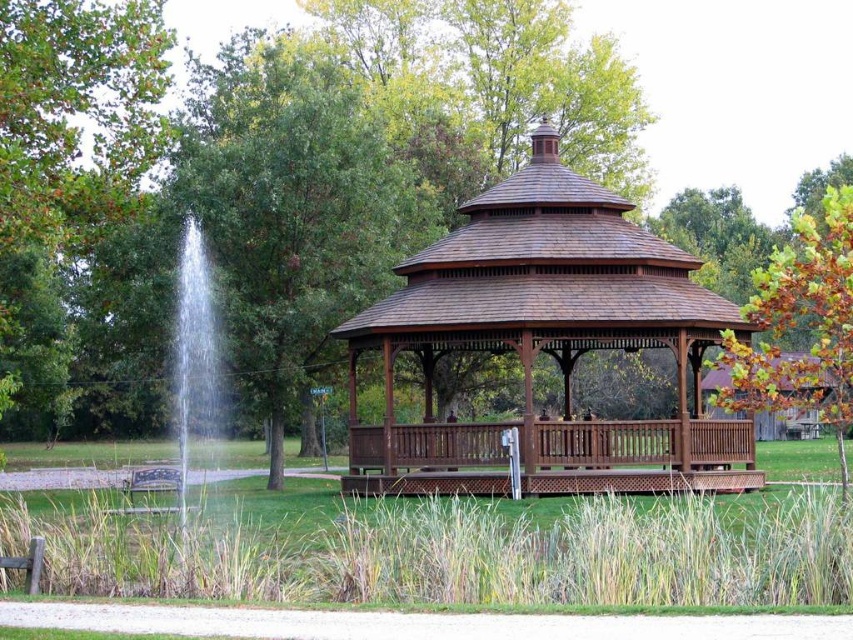
In the scene shown: Who is taller, green leafy tree at center or wooden bench at lower left?

With more height is green leafy tree at center.

Can you confirm if green leafy tree at center is thinner than wooden bench at lower left?

No, green leafy tree at center is not thinner than wooden bench at lower left.

What do you see at coordinates (735, 88) in the screenshot? I see `green leafy tree at center` at bounding box center [735, 88].

Where is `green leafy tree at center`? green leafy tree at center is located at coordinates (735, 88).

Locate an element on the screen. Image resolution: width=853 pixels, height=640 pixels. brown wooden gazebo at center is located at coordinates (546, 342).

Which of these two, brown wooden gazebo at center or green leafy tree at center, stands taller?

With more height is green leafy tree at center.

Identify the location of brown wooden gazebo at center. This screenshot has width=853, height=640. (546, 342).

Which is below, brown wooden gazebo at center or wooden bench at lower left?

Positioned lower is wooden bench at lower left.

From the picture: Can you confirm if brown wooden gazebo at center is taller than wooden bench at lower left?

Correct, brown wooden gazebo at center is much taller as wooden bench at lower left.

Where is `brown wooden gazebo at center`? This screenshot has width=853, height=640. brown wooden gazebo at center is located at coordinates (546, 342).